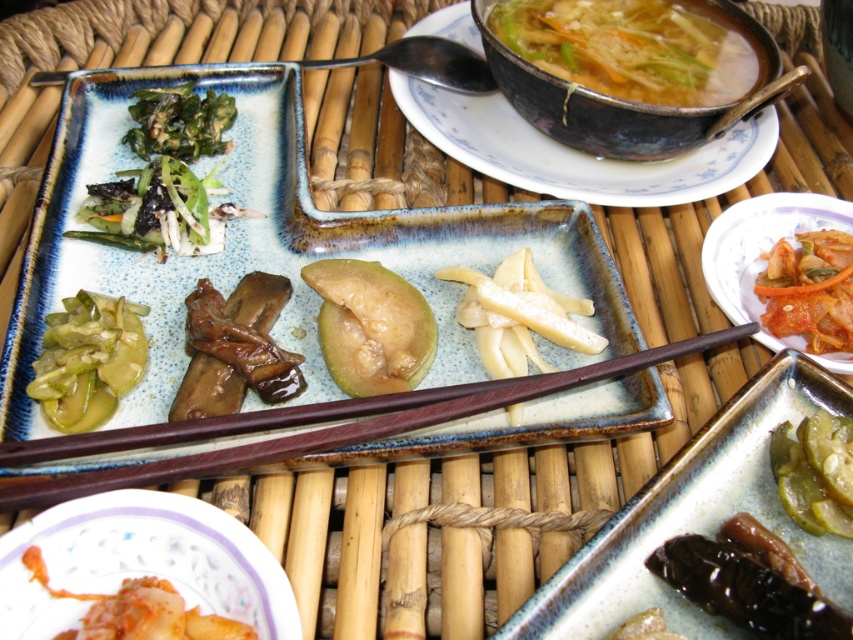
Question: Considering the relative positions of green leafy vegetables at upper left and brown wood chopsticks at center in the image provided, where is green leafy vegetables at upper left located with respect to brown wood chopsticks at center?

Choices:
 (A) below
 (B) above

Answer: (B)

Question: Is the position of brown glossy mushrooms at center more distant than that of green leafy at upper left?

Choices:
 (A) no
 (B) yes

Answer: (A)

Question: Does shiny brown chopsticks at center have a lesser width compared to brown wood chopsticks at center?

Choices:
 (A) yes
 (B) no

Answer: (A)

Question: Which of these objects is positioned farthest from the green matte avocado at center?

Choices:
 (A) tomato paste sauce at center
 (B) green leafy at upper left

Answer: (A)

Question: Which object appears closest to the camera in this image?

Choices:
 (A) green leafy at upper left
 (B) brown wood chopsticks at center
 (C) translucent broth with vegetables at upper center

Answer: (B)

Question: Which point is closer to the camera?

Choices:
 (A) 383,380
 (B) 50,548
 (C) 801,250

Answer: (B)